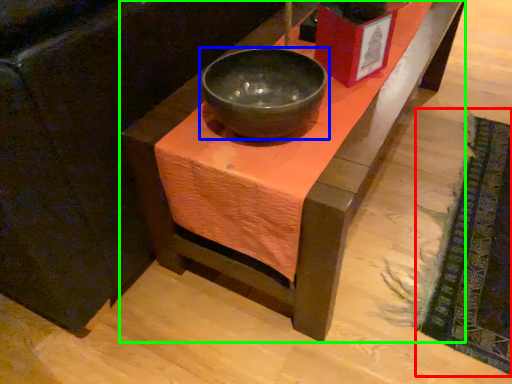
Question: Which object is positioned farthest from mat (highlighted by a red box)? Select from bowl (highlighted by a blue box) and table (highlighted by a green box).

Choices:
 (A) bowl
 (B) table

Answer: (A)